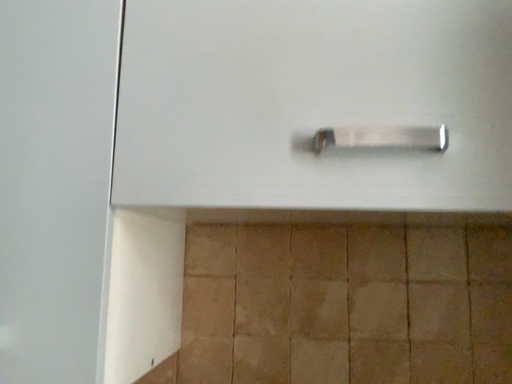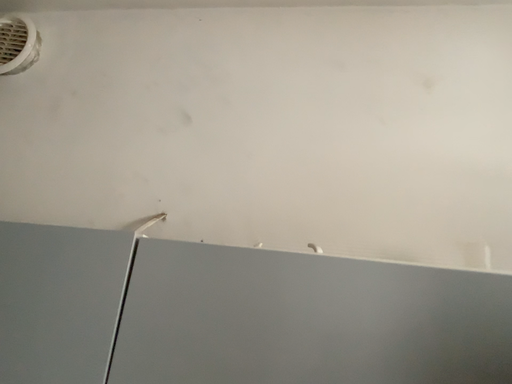
Question: How did the camera likely rotate when shooting the video?

Choices:
 (A) rotated downward
 (B) rotated upward

Answer: (B)